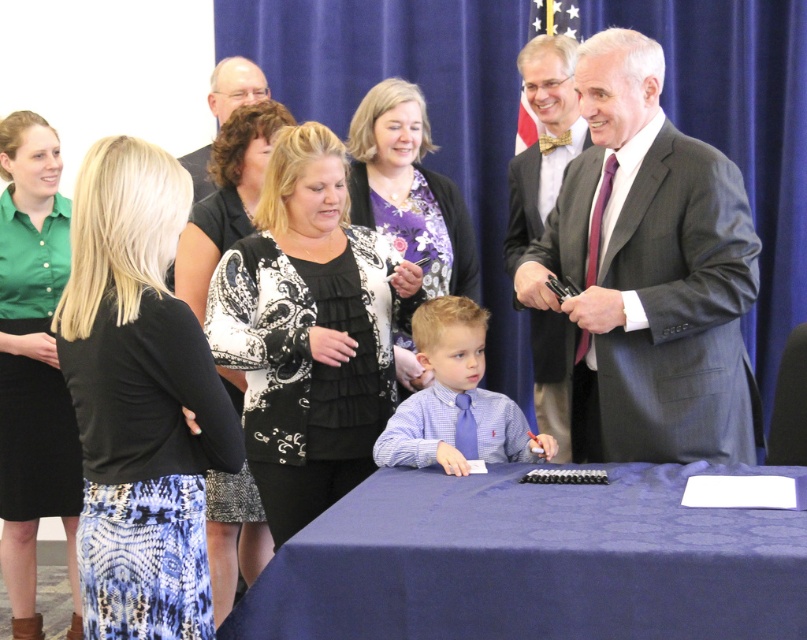
Question: Is blue fabric tablecloth at center further to the viewer compared to black textured skirt at left?

Choices:
 (A) no
 (B) yes

Answer: (A)

Question: Can you confirm if black textured skirt at left is positioned above green button-down shirt at upper left?

Choices:
 (A) yes
 (B) no

Answer: (A)

Question: Which object appears closest to the camera in this image?

Choices:
 (A) blue satin shirt at center
 (B) gray suit at right
 (C) black textured skirt at left
 (D) matte gray suit at upper right

Answer: (C)

Question: Considering the relative positions of gray suit at right and black and white patterned dress at center in the image provided, where is gray suit at right located with respect to black and white patterned dress at center?

Choices:
 (A) above
 (B) below

Answer: (A)

Question: Considering the real-world distances, which object is closest to the blue satin shirt at center?

Choices:
 (A) gray suit at right
 (B) black and white patterned dress at center

Answer: (A)

Question: Which object is the closest to the gray suit at right?

Choices:
 (A) black textured skirt at left
 (B) floral-patterned blouse at center
 (C) blue fabric tablecloth at center
 (D) black lace top at center

Answer: (C)